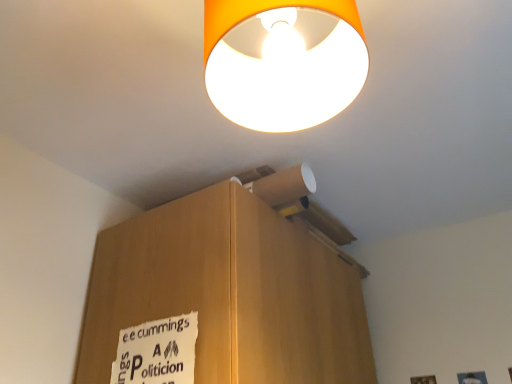
Question: Does white paper sign at lower left have a lesser height compared to orange matte lampshade at upper center?

Choices:
 (A) no
 (B) yes

Answer: (A)

Question: Can we say white paper sign at lower left lies outside orange matte lampshade at upper center?

Choices:
 (A) yes
 (B) no

Answer: (A)

Question: Is the depth of white paper sign at lower left less than that of orange matte lampshade at upper center?

Choices:
 (A) no
 (B) yes

Answer: (A)

Question: Is the position of white paper sign at lower left more distant than that of orange matte lampshade at upper center?

Choices:
 (A) yes
 (B) no

Answer: (A)

Question: Considering the relative sizes of white paper sign at lower left and orange matte lampshade at upper center in the image provided, is white paper sign at lower left taller than orange matte lampshade at upper center?

Choices:
 (A) no
 (B) yes

Answer: (B)

Question: Is white paper sign at lower left looking in the opposite direction of orange matte lampshade at upper center?

Choices:
 (A) no
 (B) yes

Answer: (A)

Question: From the image's perspective, does orange matte lampshade at upper center appear higher than white paper sign at lower left?

Choices:
 (A) yes
 (B) no

Answer: (A)

Question: Could you tell me if orange matte lampshade at upper center is facing white paper sign at lower left?

Choices:
 (A) no
 (B) yes

Answer: (A)

Question: Is orange matte lampshade at upper center at the left side of white paper sign at lower left?

Choices:
 (A) no
 (B) yes

Answer: (A)

Question: Considering the relative sizes of orange matte lampshade at upper center and white paper sign at lower left in the image provided, is orange matte lampshade at upper center taller than white paper sign at lower left?

Choices:
 (A) yes
 (B) no

Answer: (B)

Question: Does orange matte lampshade at upper center have a smaller size compared to white paper sign at lower left?

Choices:
 (A) no
 (B) yes

Answer: (A)

Question: From a real-world perspective, is orange matte lampshade at upper center positioned over white paper sign at lower left based on gravity?

Choices:
 (A) no
 (B) yes

Answer: (B)

Question: From the image's perspective, is white paper sign at lower left located above or below orange matte lampshade at upper center?

Choices:
 (A) above
 (B) below

Answer: (B)